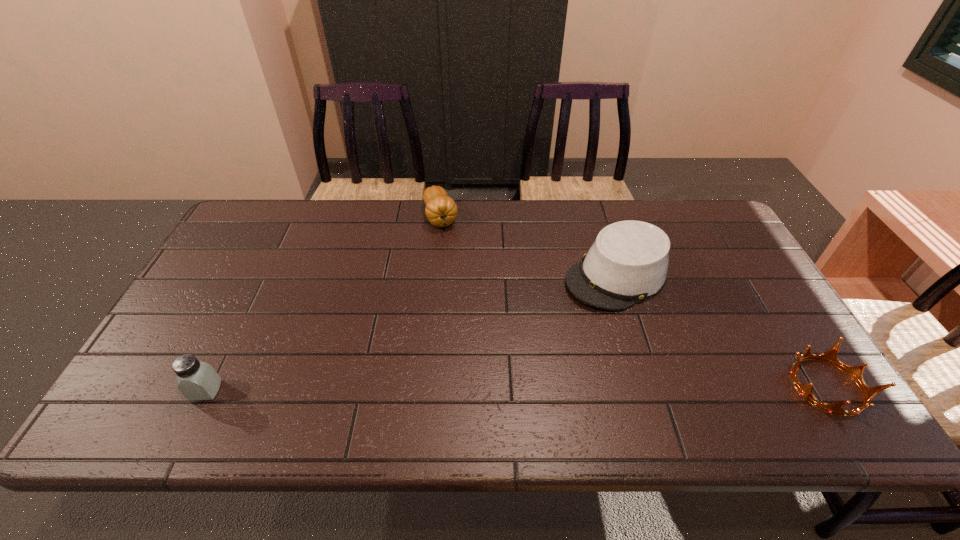
This screenshot has height=540, width=960. I want to click on free spot between the hat and the gourd, so point(528,247).

The image size is (960, 540). In order to click on vacant space in between the crown and the saltshaker in this screenshot , I will do `click(516, 388)`.

I want to click on free space between the farthest object and the hat, so click(528, 247).

This screenshot has height=540, width=960. In order to click on free space between the gourd and the hat in this screenshot , I will do `click(528, 247)`.

This screenshot has height=540, width=960. I want to click on free space between the farthest object and the third nearest object, so click(x=528, y=247).

The width and height of the screenshot is (960, 540). In order to click on vacant area that lies between the second object from left to right and the saltshaker in this screenshot , I will do `click(324, 304)`.

The image size is (960, 540). I want to click on vacant region between the third object from left to right and the second object from left to right, so 528,247.

Where is `unoccupied position between the shortest object and the leftmost object`? The image size is (960, 540). unoccupied position between the shortest object and the leftmost object is located at coordinates (516, 388).

Select which object is the third closest to the rightmost object. Please provide its 2D coordinates. Your answer should be formatted as a tuple, i.e. [(x, y)], where the tuple contains the x and y coordinates of a point satisfying the conditions above.

[(197, 380)]

Find the location of a particular element. The image size is (960, 540). object that is the second closest to the hat is located at coordinates tap(441, 210).